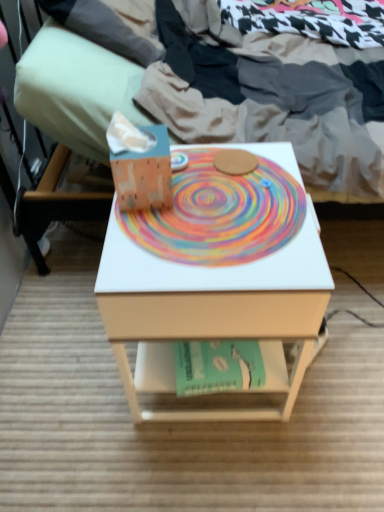
Question: Which is correct: matte white bed at center is inside white matte desk at center, or outside of it?

Choices:
 (A) inside
 (B) outside

Answer: (B)

Question: From a real-world perspective, relative to white matte desk at center, is matte white bed at center vertically above or below?

Choices:
 (A) above
 (B) below

Answer: (A)

Question: Estimate the real-world distances between objects in this image. Which object is closer to the rainbow painted paper at center?

Choices:
 (A) teal paper at center
 (B) matte orange tissue box at center
 (C) matte green pillow at upper left
 (D) white matte desk at center
 (E) matte white bed at center

Answer: (D)

Question: Based on their relative distances, which object is nearer to the matte white bed at center?

Choices:
 (A) white matte desk at center
 (B) matte orange tissue box at center
 (C) matte green pillow at upper left
 (D) rainbow painted paper at center
 (E) teal paper at center

Answer: (C)